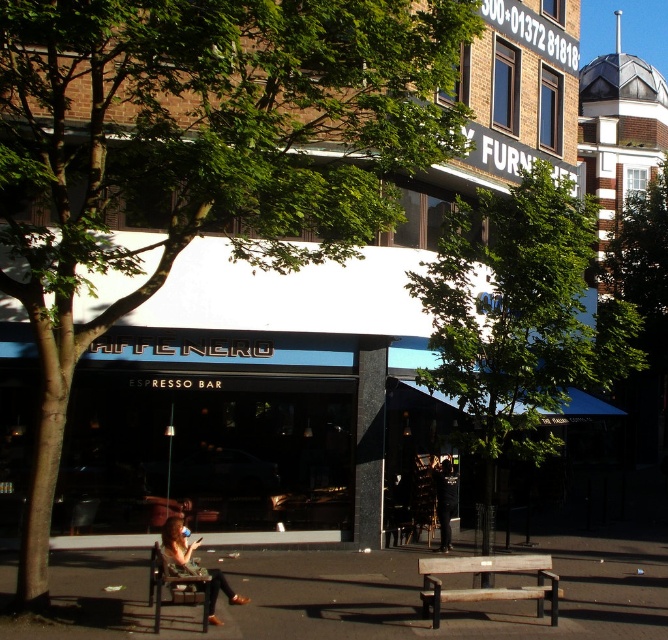
You are a customer waiting outside the Affe Nero Espresso Bar and notice a green leafy tree at center and a person with matte brown hair at lower center. Which object is taller?

The green leafy tree at center is taller than the matte brown hair at lower center.

You are standing on the sidewalk in front of the Affe Nero Espresso Bar. You notice a point marked at coordinates (198, 154). What object is located at that point?

The point at coordinates (198, 154) indicates a green leafy tree at upper left.